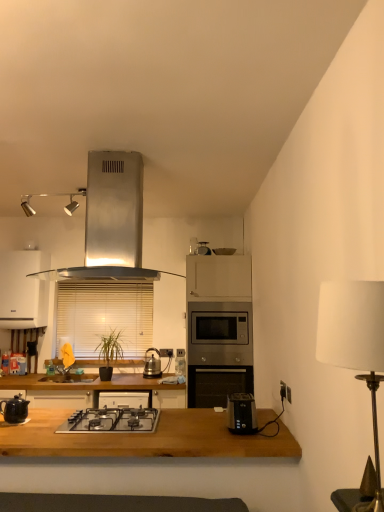
Question: Would you say matte black kettle at left, the 1th kitchen appliance from the left, is to the left or to the right of white plastic electric outlet at center, which is the 3th electric outlet in right-to-left order, in the picture?

Choices:
 (A) right
 (B) left

Answer: (B)

Question: In terms of height, does matte black kettle at left, the 1th kitchen appliance from the left, look taller or shorter compared to white plastic electric outlet at center, the 1th electric outlet positioned from the back?

Choices:
 (A) short
 (B) tall

Answer: (B)

Question: Which is farther from the satin silver microwave at center, the 1th oven when ordered from top to bottom?

Choices:
 (A) stainless steel gas stove at center
 (B) metallic silver scale at upper center
 (C) stainless steel oven at center, the second oven positioned from the top
 (D) black plastic electric outlet at right, positioned as the 2th electric outlet in front-to-back order
 (E) wooden table at center

Answer: (E)

Question: Considering the real-world distances, which object is closest to the white fabric lampshade at right?

Choices:
 (A) white plastic electric outlet at center, acting as the third electric outlet starting from the front
 (B) shiny metallic kettle at center, which ranks as the 3th kitchen appliance in front-to-back order
 (C) wooden table at center
 (D) stainless steel gas stove at center
 (E) matte black kettle at left, the 1th kitchen appliance from the left

Answer: (C)